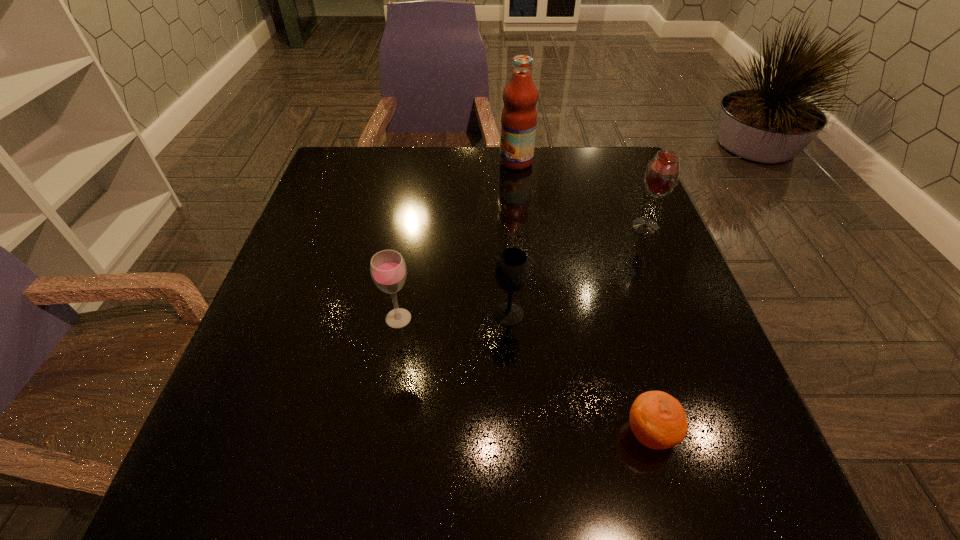
Where is `vacant space located 0.210m on the front label of the tallest object`? Image resolution: width=960 pixels, height=540 pixels. vacant space located 0.210m on the front label of the tallest object is located at coordinates (427, 161).

Where is `vacant space located 0.140m on the left of the rightmost object`? The width and height of the screenshot is (960, 540). vacant space located 0.140m on the left of the rightmost object is located at coordinates click(572, 226).

Identify the location of vacant space situated on the front of the leftmost object. [x=380, y=430].

This screenshot has height=540, width=960. Identify the location of free space located 0.250m on the front of the second wineglass from right to left. (516, 454).

I want to click on free region located on the back of the fourth object from left to right, so click(629, 359).

I want to click on object situated at the far edge, so click(519, 115).

Locate an element on the screen. object that is at the near edge is located at coordinates click(658, 420).

Locate an element on the screen. wineglass that is at the right edge is located at coordinates (662, 174).

Identify the location of orange situated at the right edge. The image size is (960, 540). (658, 420).

Find the location of `object present at the near right corner`. object present at the near right corner is located at coordinates (658, 420).